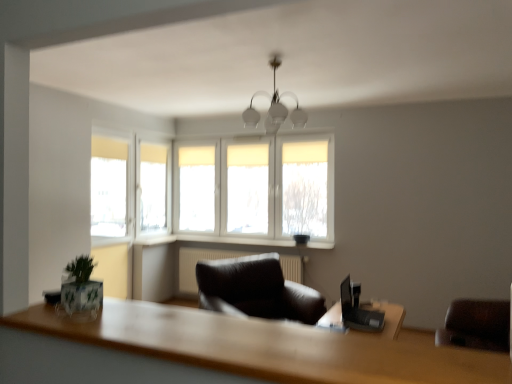
Question: Is white frosted glass chandelier at center facing away from wooden table at lower center?

Choices:
 (A) no
 (B) yes

Answer: (A)

Question: Could you tell me if white frosted glass chandelier at center is turned towards wooden table at lower center?

Choices:
 (A) no
 (B) yes

Answer: (A)

Question: Is white frosted glass chandelier at center taller than wooden table at lower center?

Choices:
 (A) yes
 (B) no

Answer: (A)

Question: Is white frosted glass chandelier at center directly adjacent to wooden table at lower center?

Choices:
 (A) yes
 (B) no

Answer: (B)

Question: From the image's perspective, is white frosted glass chandelier at center under wooden table at lower center?

Choices:
 (A) yes
 (B) no

Answer: (B)

Question: Does white frosted glass chandelier at center appear on the left side of wooden table at lower center?

Choices:
 (A) yes
 (B) no

Answer: (B)

Question: From the image's perspective, is wooden table at lower center located above black plastic laptop at right?

Choices:
 (A) no
 (B) yes

Answer: (B)

Question: From a real-world perspective, is wooden table at lower center physically above black plastic laptop at right?

Choices:
 (A) yes
 (B) no

Answer: (A)

Question: Can you confirm if wooden table at lower center is thinner than black plastic laptop at right?

Choices:
 (A) yes
 (B) no

Answer: (B)

Question: Is wooden table at lower center aimed at black plastic laptop at right?

Choices:
 (A) no
 (B) yes

Answer: (A)

Question: Does wooden table at lower center lie behind black plastic laptop at right?

Choices:
 (A) no
 (B) yes

Answer: (A)

Question: Does wooden table at lower center have a smaller size compared to black plastic laptop at right?

Choices:
 (A) no
 (B) yes

Answer: (B)

Question: Is white fabric window at center not close to green matte plant at lower left?

Choices:
 (A) yes
 (B) no

Answer: (A)